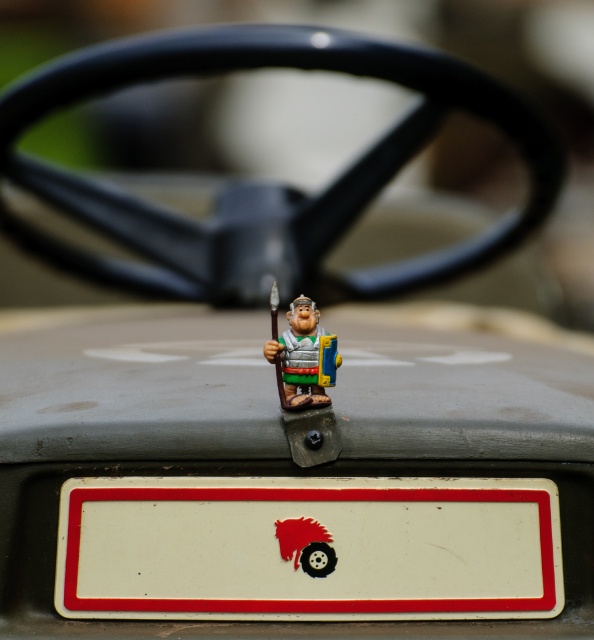
You are a passenger in a car and notice a point marked at coordinates (308,548) on the dashboard. What object is located at that point?

The point at coordinates (308,548) marks the white plastic license plate at center.

You are a delivery person who needs to place a package on the dashboard. The package is as wide as the white plastic license plate at center. Can you fit the package next to the matte plastic figurine at center without moving either item?

The white plastic license plate at center might be wider than the matte plastic figurine at center. If the license plate is wider, the package may not fit next to the figurine without overlapping. However, if they are similar in width, there might be space. Check their actual widths to confirm.

You are a delivery person who needs to place a small package on the dashboard. The package is 10 cm tall. The dashboard has a white plastic license plate at center and a matte plastic figurine at center. Can the package be placed between them without touching either?

The white plastic license plate at center is taller than the matte plastic figurine at center. Since the package is 10 cm tall, but the vertical space between them isn